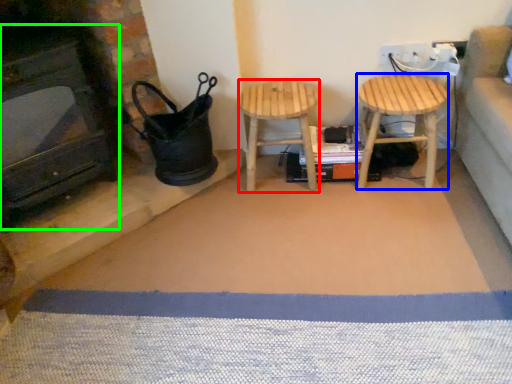
Question: Which is farther away from stool (highlighted by a red box)? stool (highlighted by a blue box) or fireplace (highlighted by a green box)?

Choices:
 (A) stool
 (B) fireplace

Answer: (B)